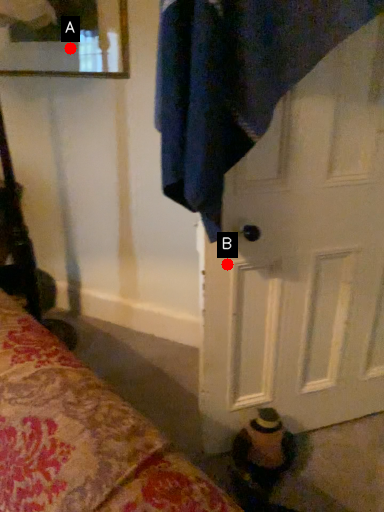
Question: Two points are circled on the image, labeled by A and B beside each circle. Among these points, which one is farthest from the camera?

Choices:
 (A) A is further
 (B) B is further

Answer: (A)